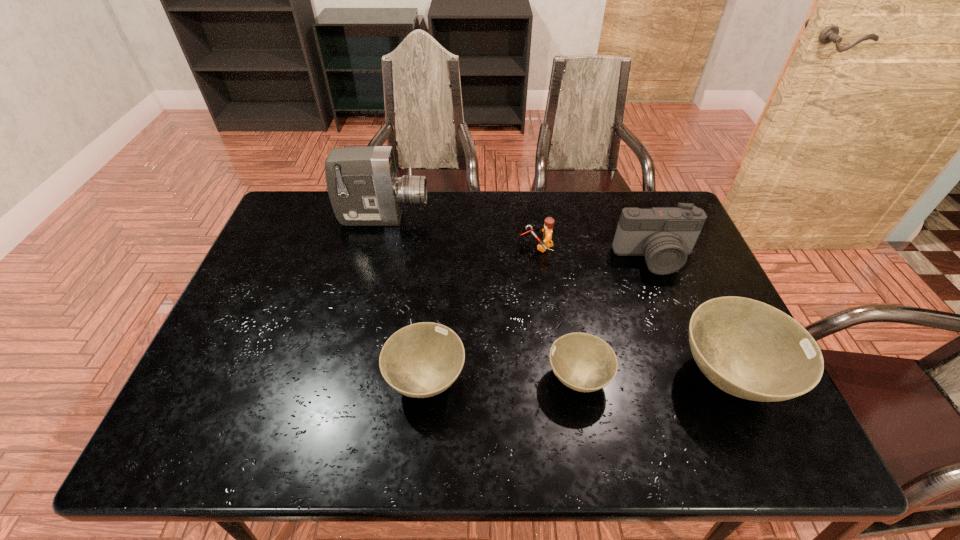
At what (x,y) coordinates should I click in order to perform the action: click on vacant space located 0.230m on the right of the second bowl from right to left. Please return your answer as a coordinate pair (x, y). Image resolution: width=960 pixels, height=540 pixels. Looking at the image, I should click on (708, 379).

Locate an element on the screen. This screenshot has height=540, width=960. free location located on the left of the rightmost bowl is located at coordinates (613, 377).

Where is `free location located 0.320m at the front of the camcorder, highlighting the lens`? free location located 0.320m at the front of the camcorder, highlighting the lens is located at coordinates (525, 218).

This screenshot has height=540, width=960. I want to click on vacant space located 0.330m at the lens of the camera, so click(x=701, y=375).

Identify the location of vacant point located holding a crossbow in the hands of the Lego. This screenshot has height=540, width=960. (420, 247).

Image resolution: width=960 pixels, height=540 pixels. What are the coordinates of `vacant area situated holding a crossbow in the hands of the Lego` in the screenshot? It's located at (501, 247).

I want to click on vacant region located holding a crossbow in the hands of the Lego, so click(504, 247).

Locate an element on the screen. camcorder at the far edge is located at coordinates (364, 190).

Locate an element on the screen. The image size is (960, 540). Lego positioned at the far edge is located at coordinates (547, 242).

Identify the location of bowl that is at the right edge. pos(749,349).